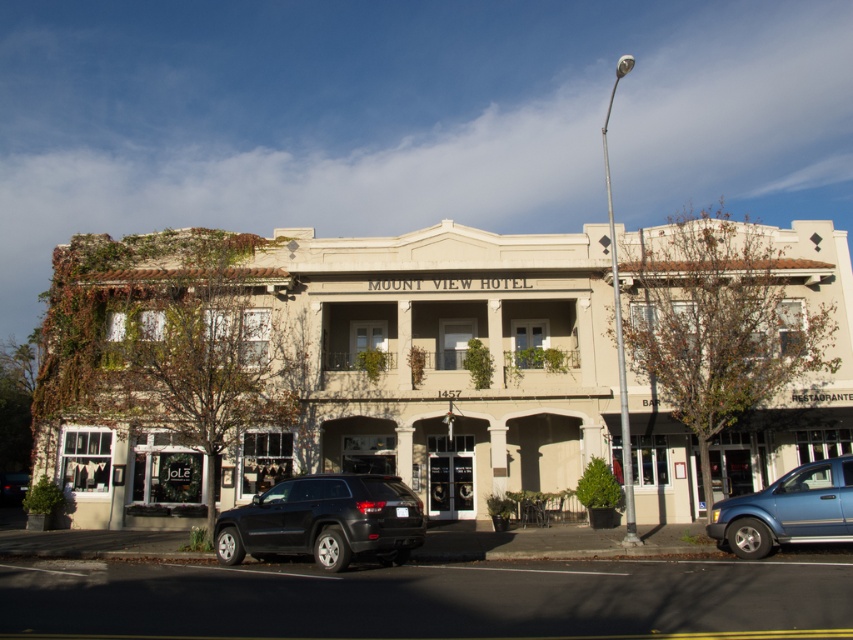
Is point (402, 532) in front of point (712, 524)?

Yes, point (402, 532) is in front of point (712, 524).

Does black matte suv at center appear under blue metallic suv at lower right?

Yes, black matte suv at center is below blue metallic suv at lower right.

Between point (294, 499) and point (809, 528), which one is positioned in front?

Positioned in front is point (809, 528).

At what (x,y) coordinates should I click in order to perform the action: click on black matte suv at center. Please return your answer as a coordinate pair (x, y). Looking at the image, I should click on (325, 520).